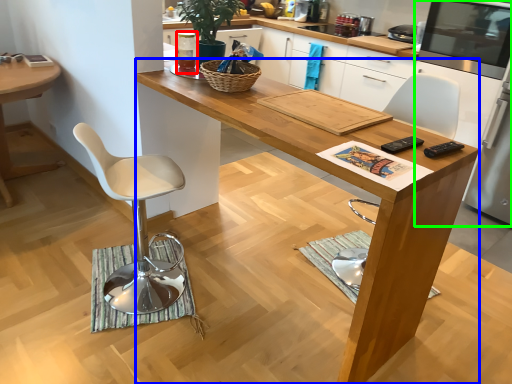
Question: Estimate the real-world distances between objects in this image. Which object is closer to appliance (highlighted by a red box), desk (highlighted by a blue box) or appliance (highlighted by a green box)?

Choices:
 (A) desk
 (B) appliance

Answer: (A)